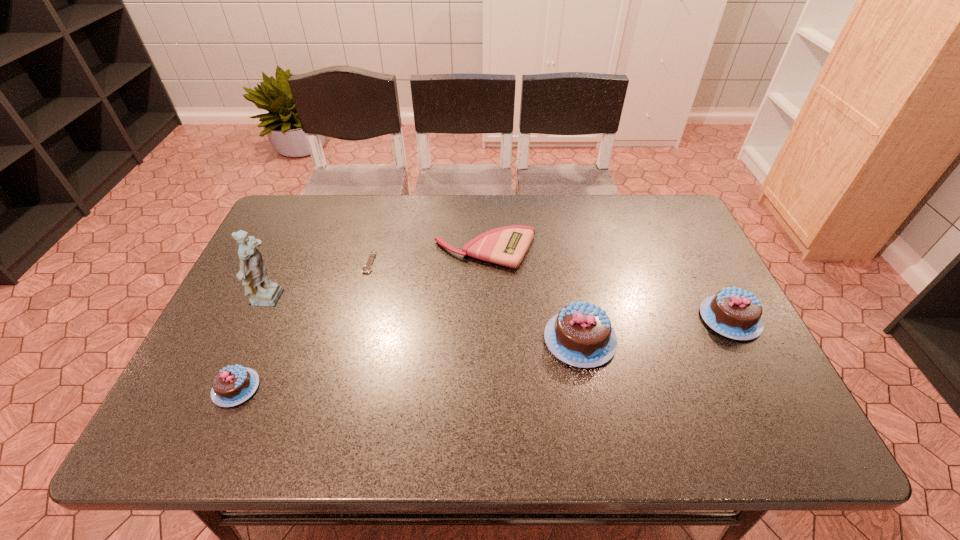
What are the coordinates of `free space located on the back of the second chocolate cake from right to left` in the screenshot? It's located at (564, 259).

Identify the location of vacant space located 0.400m on the back of the rightmost chocolate cake. Image resolution: width=960 pixels, height=540 pixels. 673,207.

The height and width of the screenshot is (540, 960). I want to click on blank space located on the left of the wristlet, so click(x=315, y=251).

Where is `free space located 0.140m on the front-facing side of the tallest object`? free space located 0.140m on the front-facing side of the tallest object is located at coordinates (342, 301).

Locate an element on the screen. The height and width of the screenshot is (540, 960). vacant space situated 0.120m on the left of the third object from left to right is located at coordinates (323, 262).

The height and width of the screenshot is (540, 960). Find the location of `object at the far edge`. object at the far edge is located at coordinates (507, 246).

This screenshot has height=540, width=960. I want to click on chocolate cake that is at the left edge, so click(231, 386).

Find the location of `figurine located at the left edge`. figurine located at the left edge is located at coordinates (262, 292).

This screenshot has width=960, height=540. In order to click on object located at the right edge in this screenshot , I will do `click(734, 313)`.

Where is `object that is positioned at the near left corner`? The image size is (960, 540). object that is positioned at the near left corner is located at coordinates (231, 386).